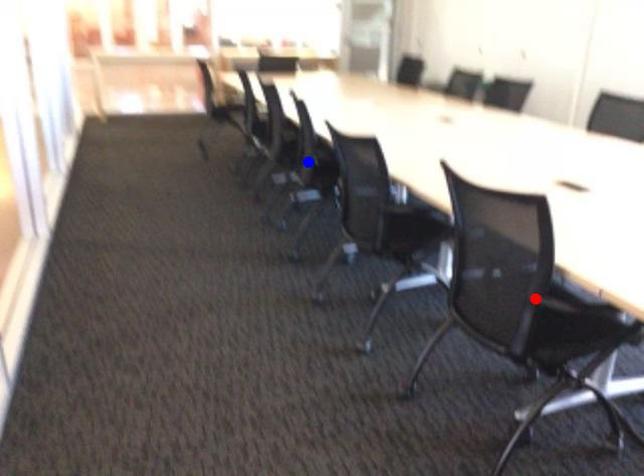
Question: Which of the two points in the image is closer to the camera?

Choices:
 (A) Blue point is closer.
 (B) Red point is closer.

Answer: (B)